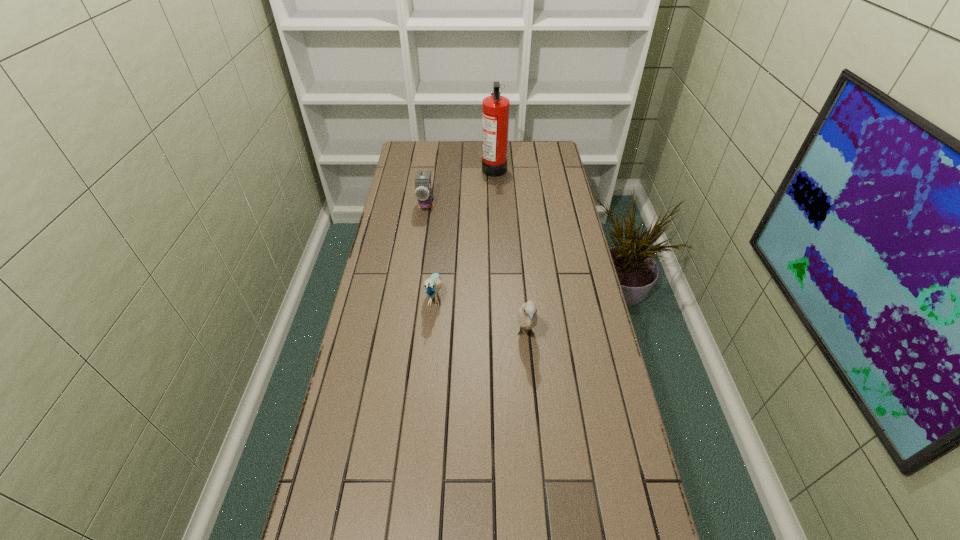
The height and width of the screenshot is (540, 960). In order to click on vacant space that satisfies the following two spatial constraints: 1. on the front-facing side of the fire extinguisher; 2. at the face of the second bird from left to right in this screenshot , I will do `click(500, 296)`.